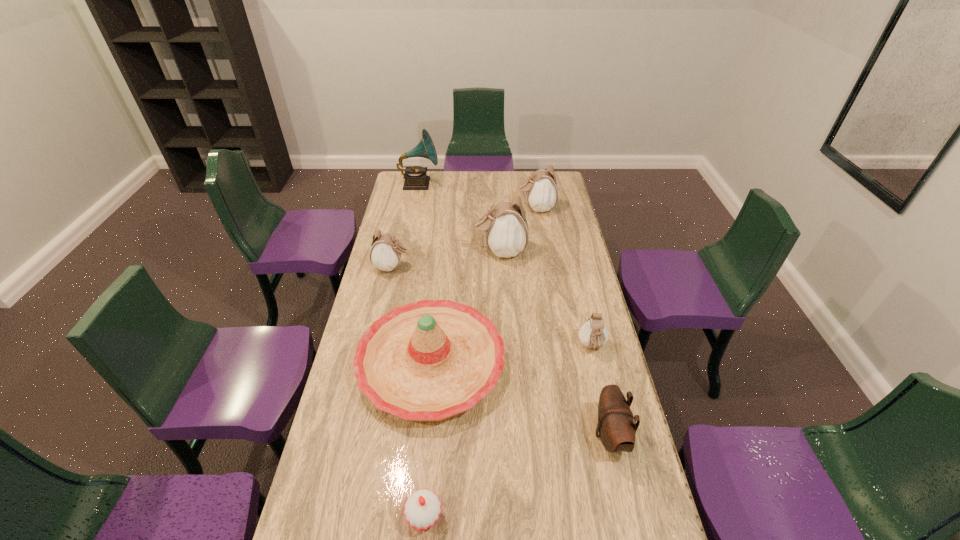
The height and width of the screenshot is (540, 960). What are the coordinates of `free point between the nearest white pouch and the fourth shortest pouch` in the screenshot? It's located at (564, 278).

Locate an element on the screen. This screenshot has width=960, height=540. free spot between the farthest object and the nearest pouch is located at coordinates (515, 309).

Identify which object is the third nearest to the nearest pouch. Please provide its 2D coordinates. Your answer should be formatted as a tuple, i.e. [(x, y)], where the tuple contains the x and y coordinates of a point satisfying the conditions above.

[(422, 509)]

Locate which object ranks sixth in proximity to the shortest pouch. Please provide its 2D coordinates. Your answer should be formatted as a tuple, i.e. [(x, y)], where the tuple contains the x and y coordinates of a point satisfying the conditions above.

[(541, 189)]

Image resolution: width=960 pixels, height=540 pixels. Identify the location of the third closest pouch to the shortest object. (385, 254).

You are a GUI agent. You are given a task and a screenshot of the screen. Output one action in this format:
    pyautogui.click(x=<x>, y=<y>)
    Task: Click on the fifth closest pouch relative to the sombrero
    The width and height of the screenshot is (960, 540).
    Given the screenshot: What is the action you would take?
    pyautogui.click(x=541, y=189)

Locate an element on the screen. The height and width of the screenshot is (540, 960). white pouch that is the second closest to the seventh nearest object is located at coordinates (385, 254).

Locate which white pouch is the fourth closest to the farthest object. Please provide its 2D coordinates. Your answer should be formatted as a tuple, i.e. [(x, y)], where the tuple contains the x and y coordinates of a point satisfying the conditions above.

[(593, 334)]

Image resolution: width=960 pixels, height=540 pixels. Identify the location of free space that satisfies the following two spatial constraints: 1. on the front-facing side of the third biggest white pouch; 2. on the right side of the red sombrero. (371, 364).

Where is `vacant space that satisfies the following two spatial constraints: 1. from the horn of the farthest object; 2. on the right side of the nearest object`? This screenshot has width=960, height=540. vacant space that satisfies the following two spatial constraints: 1. from the horn of the farthest object; 2. on the right side of the nearest object is located at coordinates (352, 517).